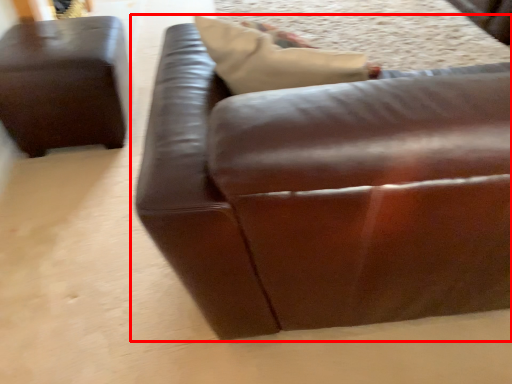
Question: From the image's perspective, where is studio couch (annotated by the red box) located in relation to studio couch in the image?

Choices:
 (A) above
 (B) below

Answer: (B)